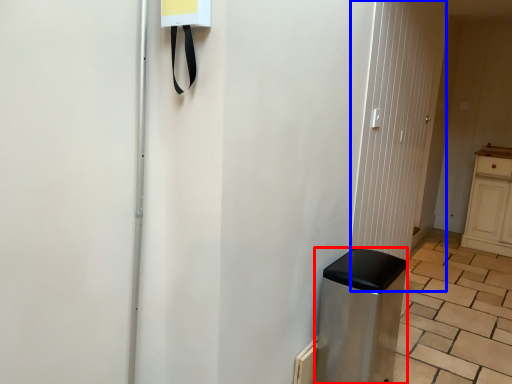
Question: Which of the following is the closest to the observer, appliance (highlighted by a red box) or screen door (highlighted by a blue box)?

Choices:
 (A) appliance
 (B) screen door

Answer: (A)